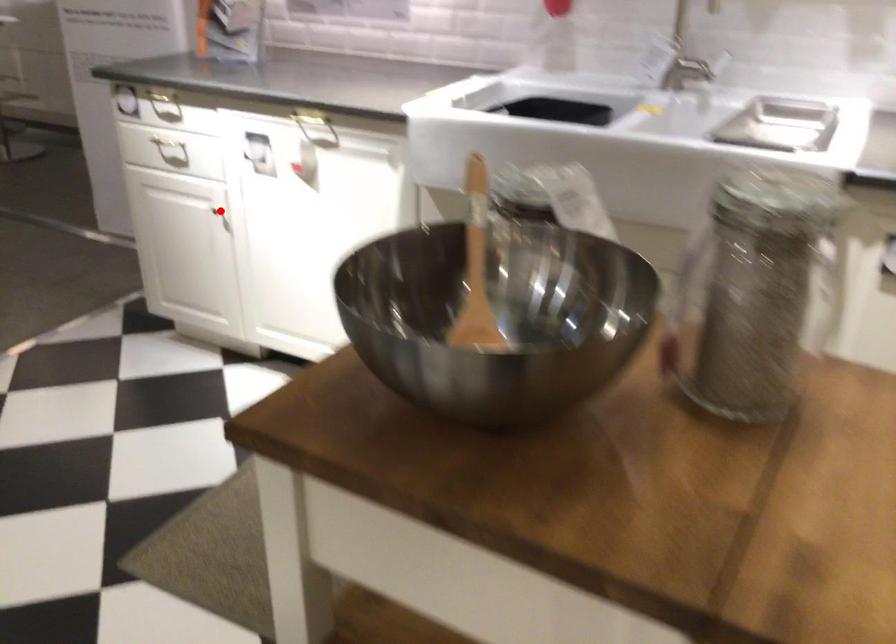
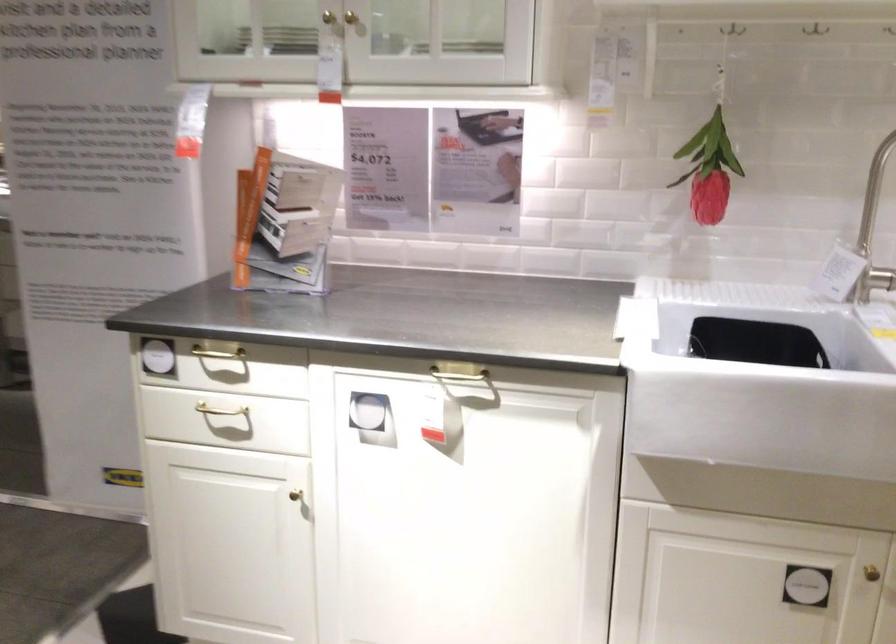
Question: A red point is marked in image1. In image2, is the corresponding 3D point closer to the camera or farther? Reply with the corresponding letter.

Choices:
 (A) The corresponding 3D point is closer.
 (B) The corresponding 3D point is farther.

Answer: (A)